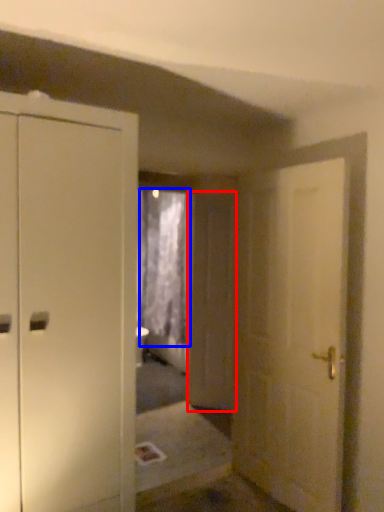
Question: Among these objects, which one is farthest to the camera, screen door (highlighted by a red box) or curtain (highlighted by a blue box)?

Choices:
 (A) screen door
 (B) curtain

Answer: (B)